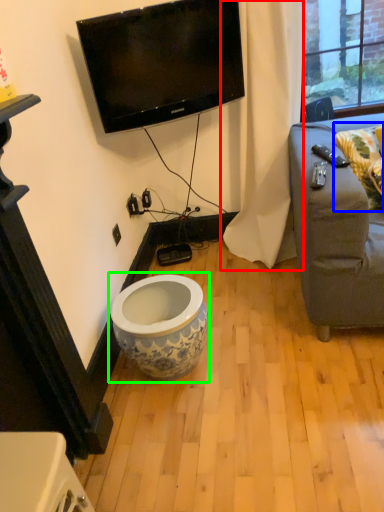
Question: Which is nearer to the curtain (highlighted by a red box)? pillow (highlighted by a blue box) or toilet (highlighted by a green box).

Choices:
 (A) pillow
 (B) toilet

Answer: (A)